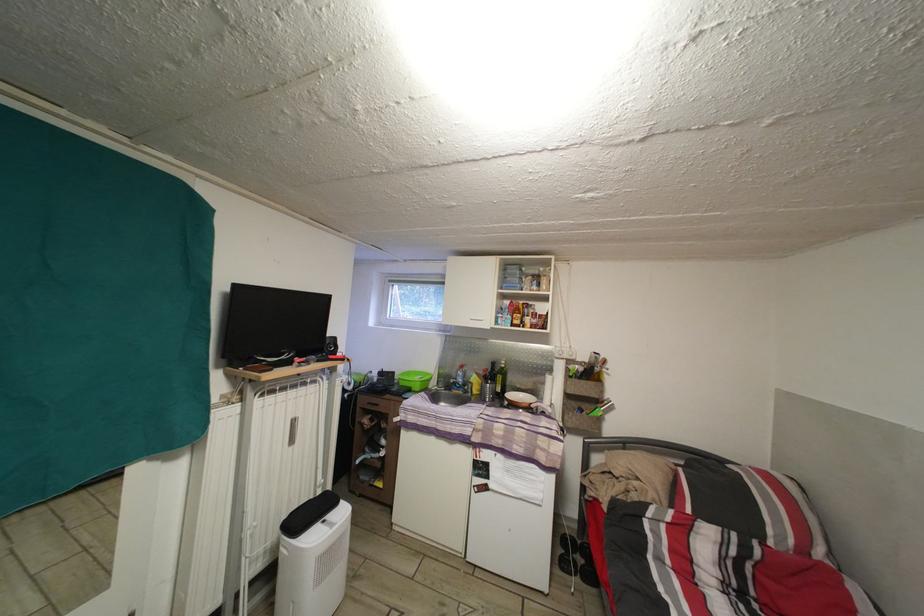
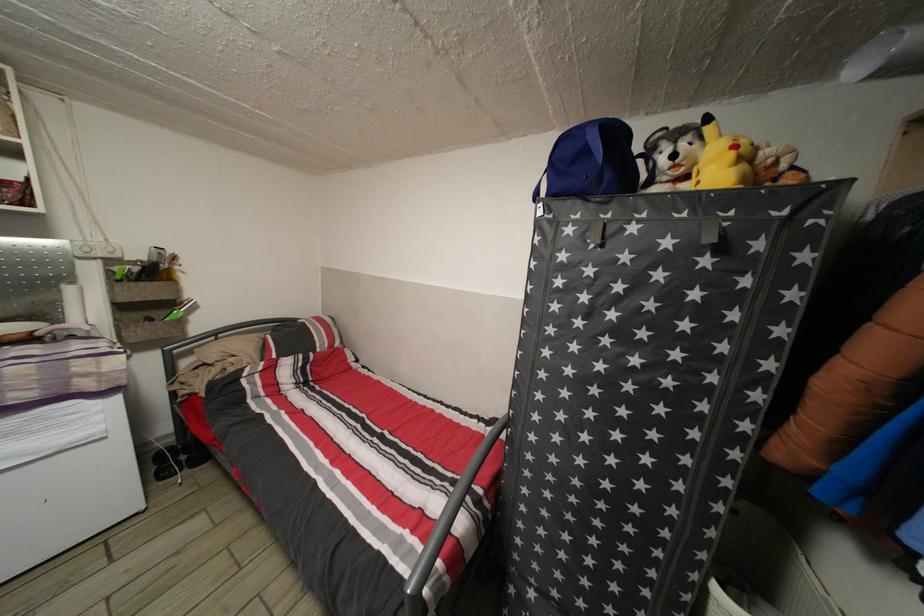
In the second image, find the point that corresponds to the point at 586,585 in the first image.

(192, 477)